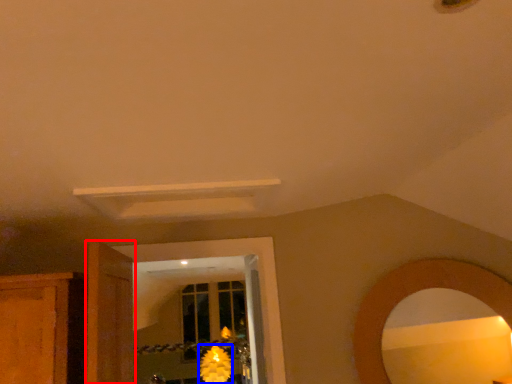
Question: Which object appears farthest to the camera in this image, door (highlighted by a red box) or flower (highlighted by a blue box)?

Choices:
 (A) door
 (B) flower

Answer: (B)